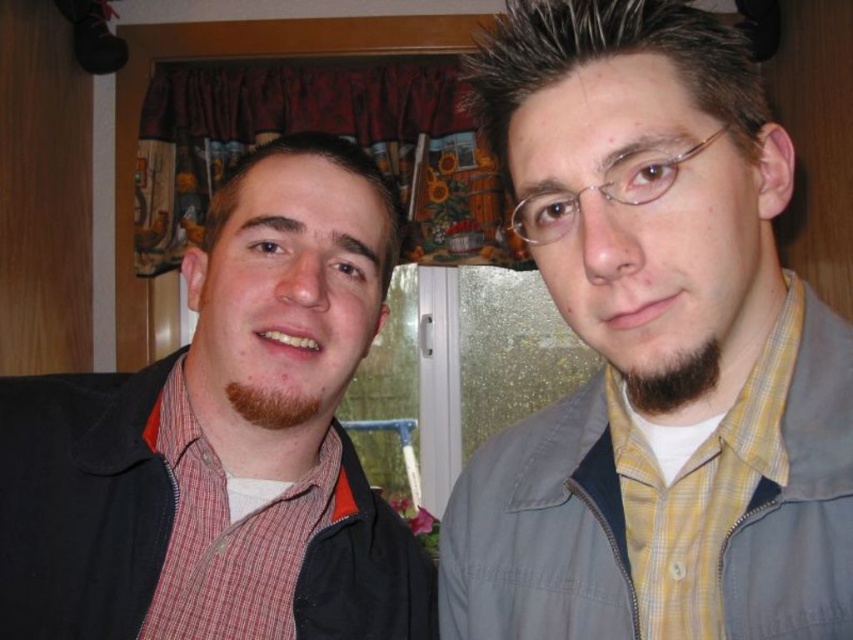
Question: Which point is farther to the camera?

Choices:
 (A) (662, 369)
 (B) (646, 1)
 (C) (256, 492)

Answer: (C)

Question: From the image, what is the correct spatial relationship of yellow checkered shirt at center in relation to brown fuzzy beard at lower left?

Choices:
 (A) right
 (B) left

Answer: (A)

Question: Is matte black jacket at left below brown fuzzy beard at lower left?

Choices:
 (A) no
 (B) yes

Answer: (B)

Question: Which object appears closest to the camera in this image?

Choices:
 (A) matte black jacket at left
 (B) yellow checkered shirt at center
 (C) dark brown fuzzy beard at center
 (D) brown fuzzy beard at lower left

Answer: (B)

Question: In this image, where is matte black jacket at left located relative to dark brown fuzzy beard at center?

Choices:
 (A) below
 (B) above

Answer: (A)

Question: Which point appears farthest from the camera in this image?

Choices:
 (A) (213, 445)
 (B) (648, 413)
 (C) (527, 246)

Answer: (C)